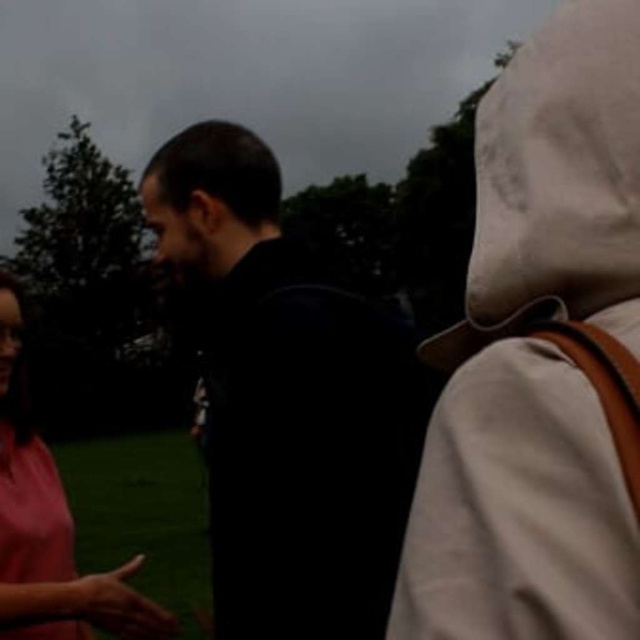
Does black matte jacket at center have a lesser width compared to pink matte shirt at left?

No, black matte jacket at center is not thinner than pink matte shirt at left.

Does point (308, 593) come in front of point (48, 500)?

Yes, point (308, 593) is in front of point (48, 500).

Measure the distance between point (374, 593) and camera.

They are 1.49 meters apart.

Find the location of a particular element. This screenshot has width=640, height=640. black matte jacket at center is located at coordinates point(289,403).